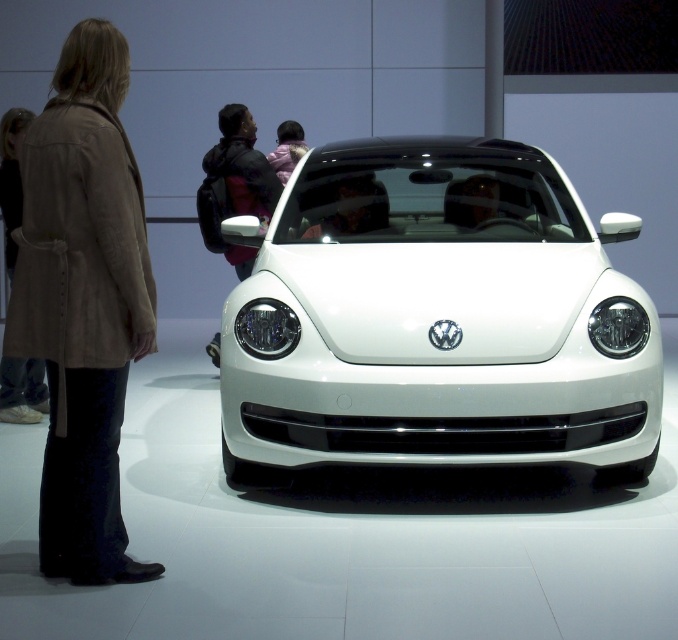
Consider the image. You are standing in front of an auto show exhibit and see the white glossy car at center. What are the coordinates of the car in the image?

The 2D location of the white glossy car at center is at point (437, 317).

You are a photographer standing at the back of the exhibition hall. You want to take a photo of the white glossy car at center without including the suede coat at left in the frame. Can you move forward enough to do so?

The distance between the white glossy car at center and the suede coat at left is 1.49 meters. Since you are a photographer at the back, moving forward would decrease the distance between you and the car, but the coat is already 1.49 meters away from the car. To exclude the coat, you need to ensure your camera angle only captures the car. However, the exact feasibility depends on the camera lens and field of view, but based on the given distance, it might be possible by positioning yourself appropriately.